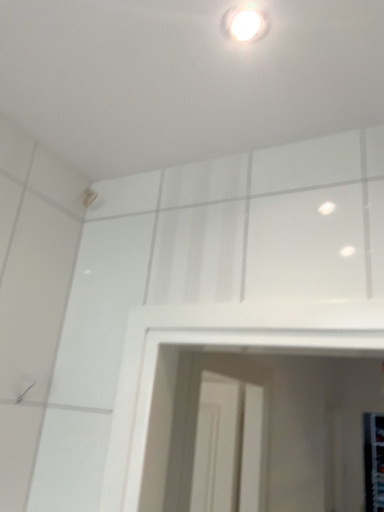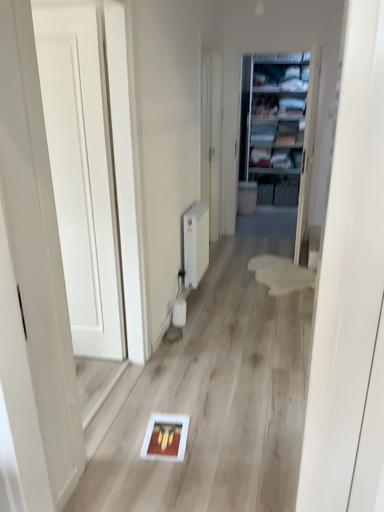
Question: Which way did the camera rotate in the video?

Choices:
 (A) rotated upward
 (B) rotated downward

Answer: (B)